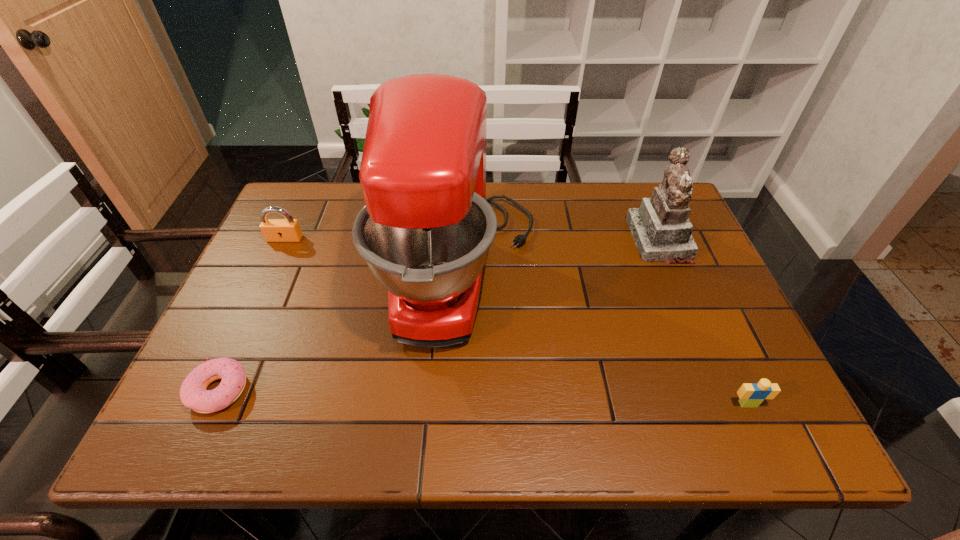
Locate an element on the screen. The height and width of the screenshot is (540, 960). vacant space located 0.180m to unlock the padlock from the front is located at coordinates (260, 292).

Locate an element on the screen. This screenshot has height=540, width=960. vacant position located on the back of the shortest object is located at coordinates (240, 346).

In order to click on kitchen mixer that is at the far edge in this screenshot , I will do `click(425, 231)`.

Identify the location of figurine located in the far edge section of the desktop. The width and height of the screenshot is (960, 540). (661, 229).

The height and width of the screenshot is (540, 960). I want to click on Lego located at the near edge, so click(752, 395).

I want to click on doughnut that is at the near edge, so click(x=193, y=393).

At what (x,y) coordinates should I click in order to perform the action: click on padlock situated at the left edge. Please return your answer as a coordinate pair (x, y). Looking at the image, I should click on (274, 230).

In order to click on doughnut situated at the left edge in this screenshot , I will do pos(193,393).

Identify the location of figurine positioned at the right edge. The height and width of the screenshot is (540, 960). (661, 229).

Locate an element on the screen. The width and height of the screenshot is (960, 540). Lego positioned at the right edge is located at coordinates 752,395.